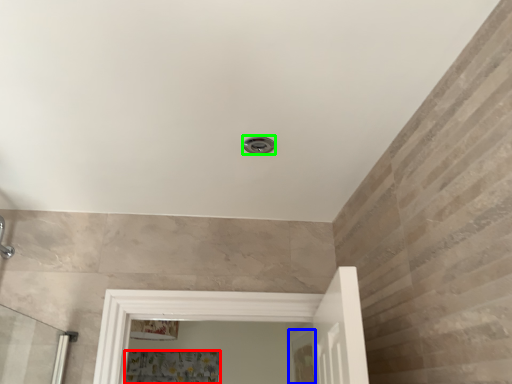
Question: Which is nearer to the shower curtain (highlighted by a red box)? screen door (highlighted by a blue box) or shower (highlighted by a green box).

Choices:
 (A) screen door
 (B) shower

Answer: (A)